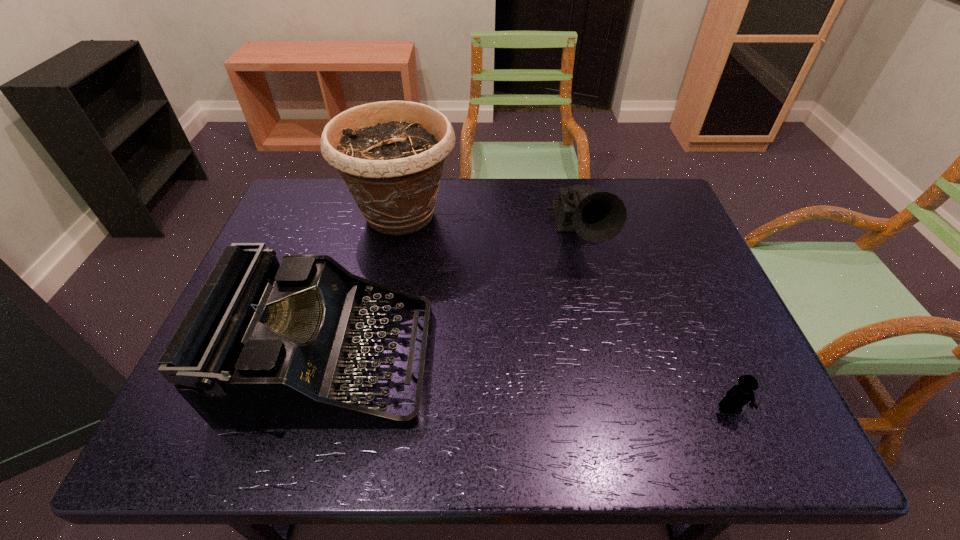
Locate an element on the screen. vacant region at the right edge is located at coordinates (693, 285).

Where is `vacant region at the far right corner`? vacant region at the far right corner is located at coordinates (652, 210).

Find the location of `vacant space that's between the typewriter and the phonograph_record`. vacant space that's between the typewriter and the phonograph_record is located at coordinates (455, 299).

This screenshot has width=960, height=540. Identify the location of free area in between the shortest object and the flowerpot. (565, 312).

What are the coordinates of `unoccupied area between the phonograph_record and the flowerpot` in the screenshot? It's located at (490, 225).

Identify the location of free spot between the shortest object and the flowerpot. This screenshot has width=960, height=540. (565, 312).

At what (x,y) coordinates should I click in order to perform the action: click on empty location between the rightmost object and the flowerpot. Please return your answer as a coordinate pair (x, y). This screenshot has height=540, width=960. Looking at the image, I should click on (565, 312).

This screenshot has height=540, width=960. In order to click on vacant space that's between the typewriter and the Lego in this screenshot , I will do `click(531, 386)`.

Where is `empty space that is in between the typewriter and the Lego`? The width and height of the screenshot is (960, 540). empty space that is in between the typewriter and the Lego is located at coordinates (531, 386).

I want to click on the closest object to the phonograph_record, so click(x=390, y=154).